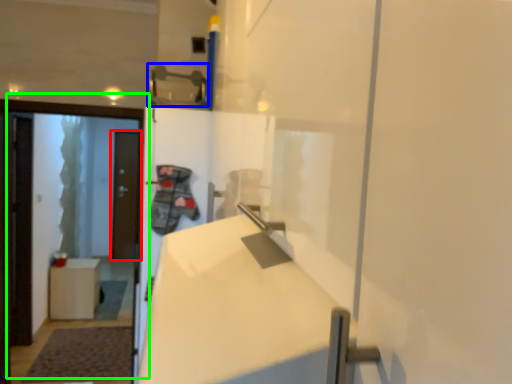
Question: Based on their relative distances, which object is nearer to door (highlighted by a red box)? Choose from door handle (highlighted by a blue box) and door (highlighted by a green box).

Choices:
 (A) door handle
 (B) door

Answer: (B)